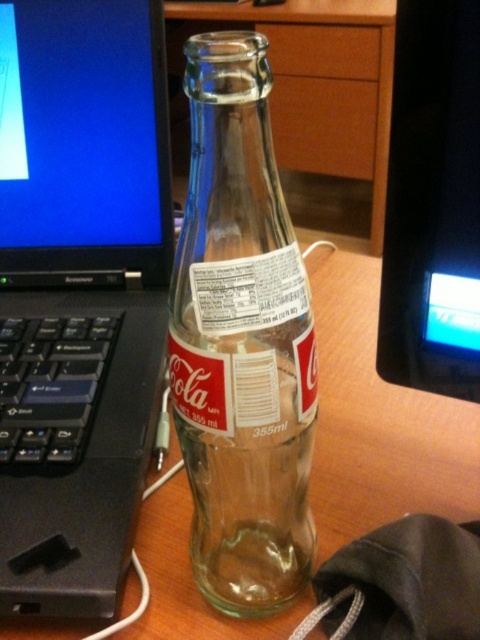
Who is positioned more to the left, clear glass bottle at center or wooden table at center?

clear glass bottle at center

Is clear glass bottle at center bigger than wooden table at center?

No.

Between point (251, 154) and point (348, 321), which one is positioned in front?

Point (251, 154) is more forward.

Locate an element on the screen. The image size is (480, 640). clear glass bottle at center is located at coordinates (240, 340).

In order to click on wooden table at center in this screenshot , I will do `click(377, 419)`.

Does wooden table at center have a lesser height compared to black glossy monitor at upper right?

No.

Is point (363, 355) closer to camera compared to point (381, 355)?

No, it is behind (381, 355).

I want to click on wooden table at center, so click(377, 419).

Is black plastic laptop at left smaller than wooden table at center?

Correct, black plastic laptop at left occupies less space than wooden table at center.

Between black plastic laptop at left and wooden table at center, which one has less height?

With less height is wooden table at center.

Does point (96, 104) come in front of point (380, 433)?

That is False.

Where is `black plastic laptop at left`? This screenshot has width=480, height=640. black plastic laptop at left is located at coordinates (79, 292).